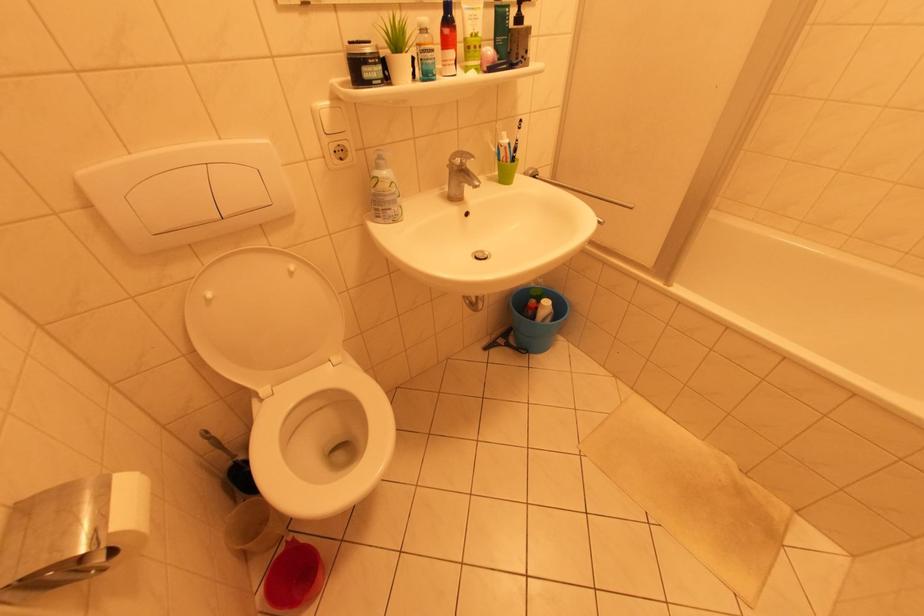
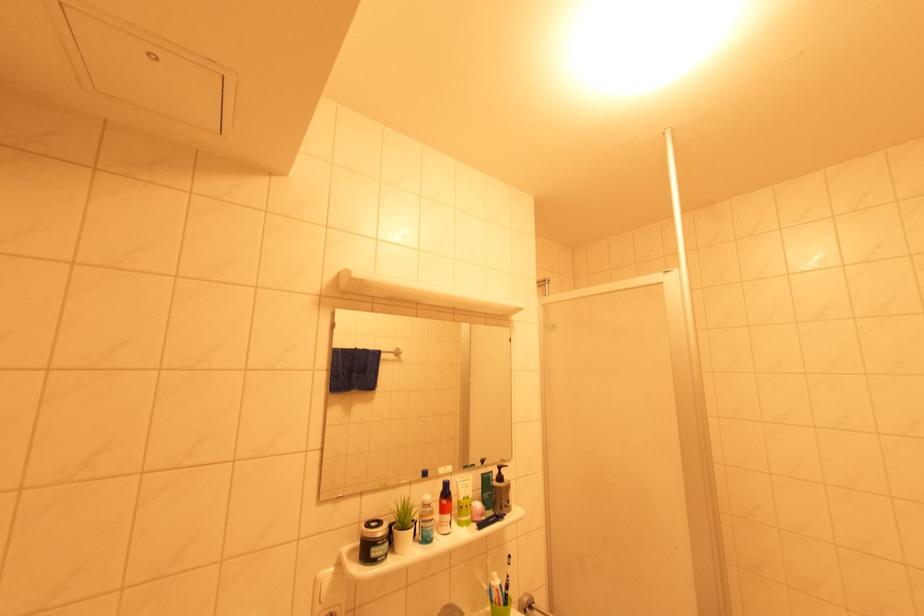
Question: The first image is from the beginning of the video and the second image is from the end. How did the camera likely rotate when shooting the video?

Choices:
 (A) Left
 (B) Right
 (C) Up
 (D) Down

Answer: (C)